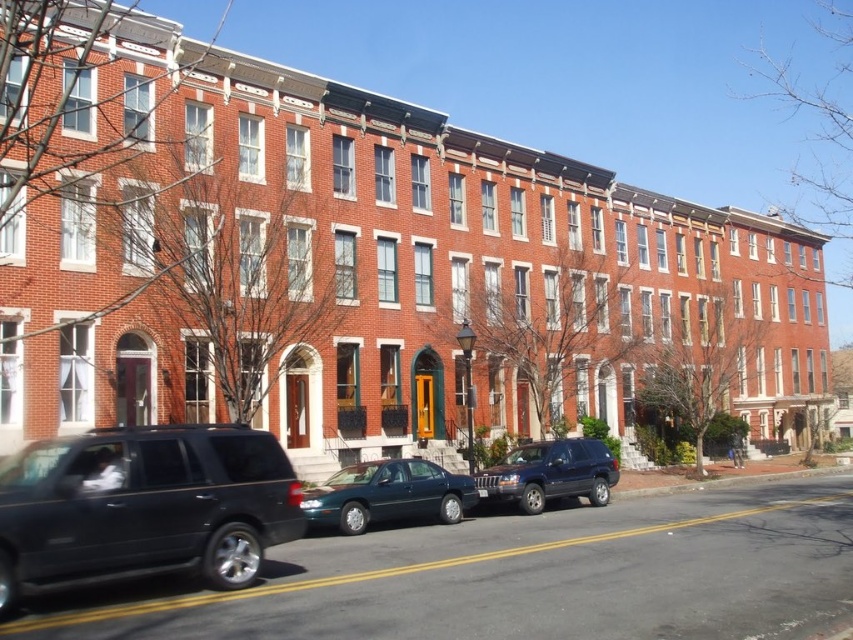
You are a delivery driver who needs to park your vehicle between the teal glossy sedan at center and the shiny dark blue suv at center. Your vehicle is 1.8 meters wide. Can you fit your vehicle between them without touching either car?

The teal glossy sedan at center is wider than the shiny dark blue suv at center. Since your vehicle is 1.8 meters wide, you need to check the available space between them. However, the exact distance between the two cars isn

You are a pedestrian standing on the sidewalk in front of the row of brick townhouses. You see the teal glossy sedan at center and the shiny dark blue suv at center. Which vehicle is closer to you?

The teal glossy sedan at center is closer to you because it is positioned in front of the shiny dark blue suv at center.

You are a pedestrian standing on the sidewalk in front of the row of brick townhouses. You see the shiny black suv at lower left and the shiny dark blue suv at center. Which SUV is positioned higher up in the image?

The shiny black suv at lower left is located above the shiny dark blue suv at center in the image.